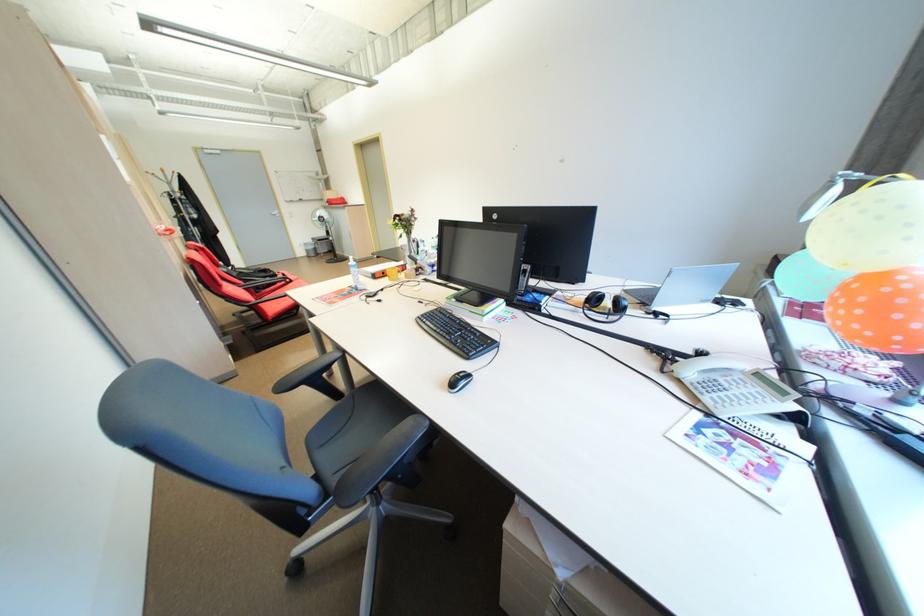
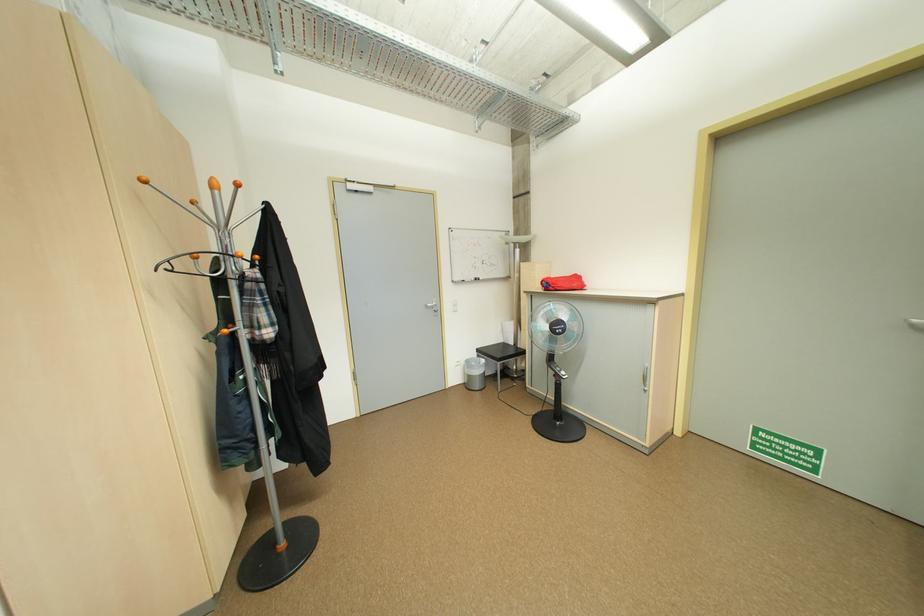
In the second image, find the point that corresponds to [321,241] in the first image.

(483, 355)